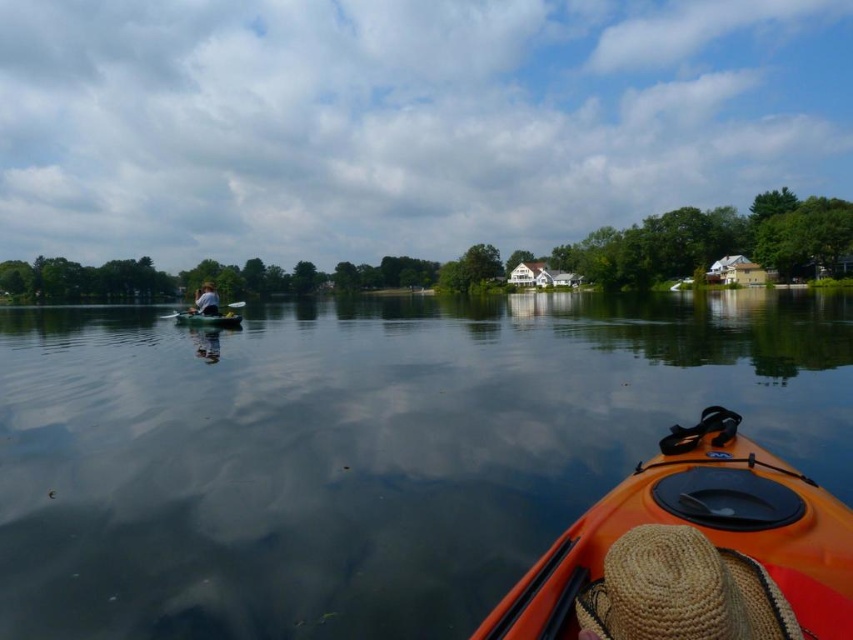
Is orange matte kayak at lower right to the left of wooden paddle at left from the viewer's perspective?

Incorrect, orange matte kayak at lower right is not on the left side of wooden paddle at left.

Measure the distance between point (x=759, y=513) and camera.

4.23 meters

Locate an element on the screen. orange matte kayak at lower right is located at coordinates (693, 552).

The width and height of the screenshot is (853, 640). I want to click on orange matte kayak at lower right, so click(x=693, y=552).

Between smooth dark water at center and orange matte kayak at lower right, which one is positioned higher?

smooth dark water at center is higher up.

Is smooth dark water at center positioned in front of orange matte kayak at lower right?

That is False.

Find the location of a particular element. The image size is (853, 640). smooth dark water at center is located at coordinates (364, 449).

The width and height of the screenshot is (853, 640). Identify the location of smooth dark water at center. (364, 449).